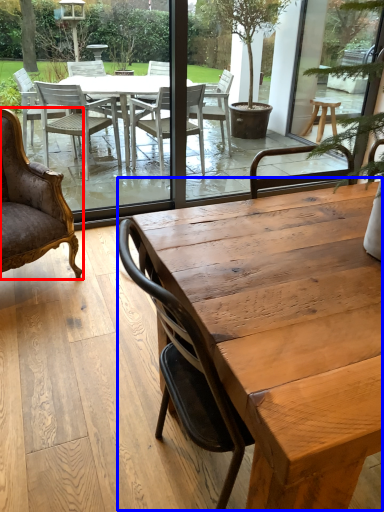
Question: Which object appears farthest to the camera in this image, chair (highlighted by a red box) or coffee table (highlighted by a blue box)?

Choices:
 (A) chair
 (B) coffee table

Answer: (A)